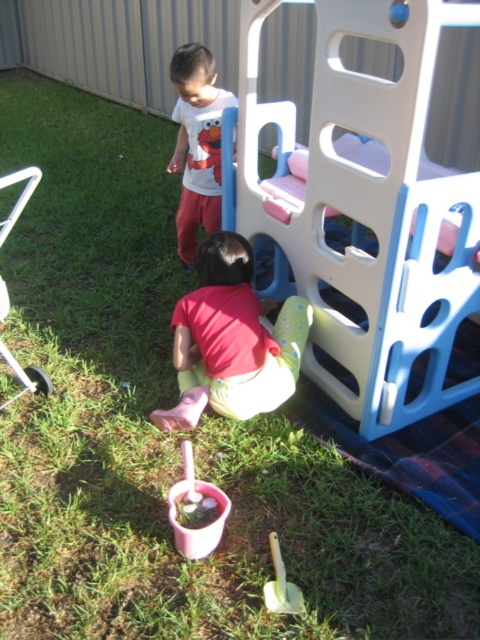
Question: Is pink plastic cup at lower center smaller than yellow plastic shovel at lower center?

Choices:
 (A) yes
 (B) no

Answer: (B)

Question: Among these objects, which one is farthest from the camera?

Choices:
 (A) pink rubber boots at lower center
 (B) yellow plastic shovel at lower center

Answer: (A)

Question: Is white matte shirt at upper center above yellow plastic shovel at lower center?

Choices:
 (A) yes
 (B) no

Answer: (A)

Question: Among these objects, which one is farthest from the camera?

Choices:
 (A) yellow plastic shovel at lower center
 (B) pink plastic cup at lower center
 (C) white matte shirt at upper center

Answer: (C)

Question: Can you confirm if pink rubber boots at lower center is thinner than yellow plastic shovel at lower center?

Choices:
 (A) yes
 (B) no

Answer: (B)

Question: Estimate the real-world distances between objects in this image. Which object is farther from the pink plastic cup at lower center?

Choices:
 (A) pink rubber boots at lower center
 (B) white matte shirt at upper center

Answer: (B)